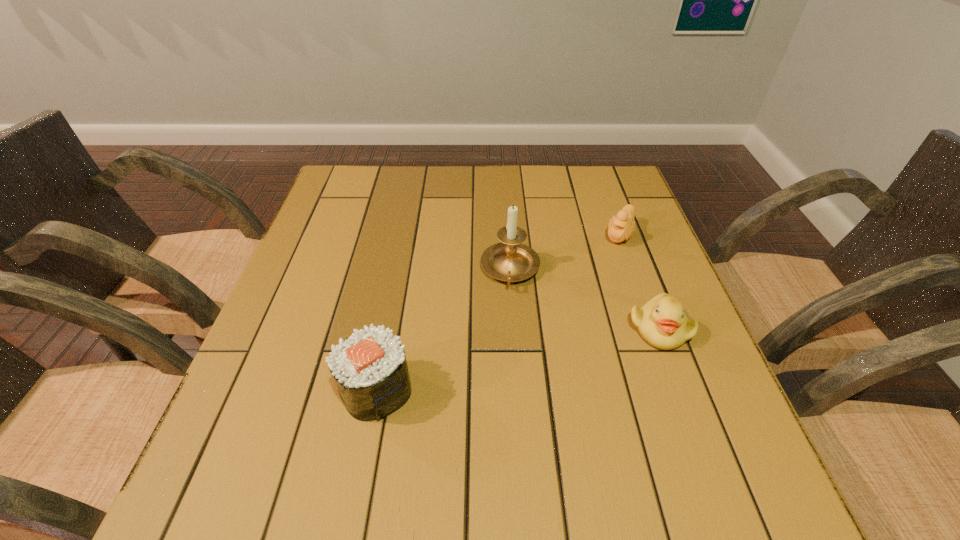
The image size is (960, 540). Find the location of `the leftmost object`. the leftmost object is located at coordinates (370, 369).

At what (x,y) coordinates should I click in order to perform the action: click on sushi. Please return your answer as a coordinate pair (x, y). The height and width of the screenshot is (540, 960). Looking at the image, I should click on (370, 369).

The image size is (960, 540). I want to click on the second nearest object, so click(662, 323).

Identify the location of the farther duckling. (621, 227).

This screenshot has height=540, width=960. In order to click on the second object from left to right in this screenshot , I will do `click(510, 260)`.

Image resolution: width=960 pixels, height=540 pixels. In order to click on candle holder in this screenshot , I will do `click(510, 260)`.

In order to click on free space located on the right of the nearest object in this screenshot , I will do `click(617, 389)`.

The width and height of the screenshot is (960, 540). I want to click on vacant space located at the face of the nearer duckling, so click(x=701, y=439).

The width and height of the screenshot is (960, 540). I want to click on vacant space located 0.120m on the face of the farther duckling, so click(601, 275).

This screenshot has width=960, height=540. Identify the location of vacant space located on the face of the farther duckling. (569, 333).